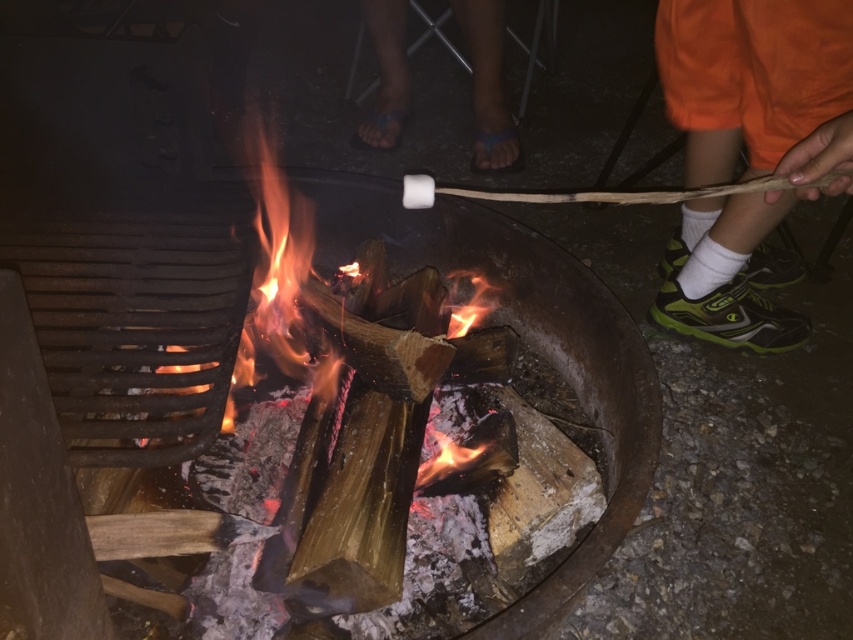
Looking at this image, you are trying to decide which item to use to protect your feet from the fire pit. The orange fabric sock at lower right and the blue rubber sandals at center are available. Which one has a wider base to cover more of your feet?

The orange fabric sock at lower right has a larger width than the blue rubber sandals at center, so it would provide a wider coverage for your feet.

You are standing in front of the fire pit and want to hand the orange fabric sock at lower right to someone behind you. Can you reach it without moving your feet?

The orange fabric sock at lower right is 4.73 feet away from the viewer. Since the average human arm length is about 2.5 feet, you cannot reach it without moving your feet.

You are standing in the campsite and notice the orange fabric sock at lower right and the blue rubber sandals at center. Which item is located closer to the ground?

The orange fabric sock at lower right is positioned under blue rubber sandals at center, so it is closer to the ground.